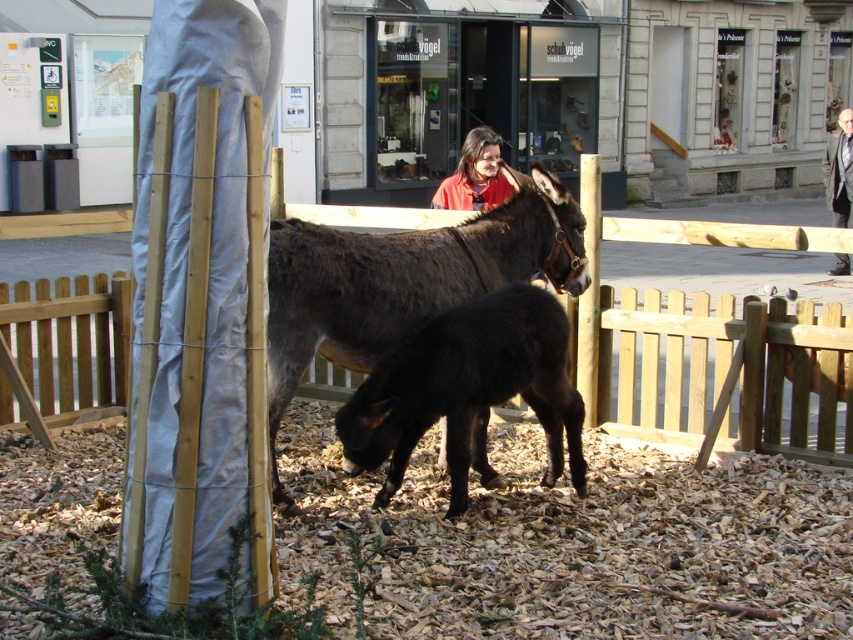
Question: Can you confirm if wooden fence at center is positioned above dark brown glossy donkey at center?

Choices:
 (A) yes
 (B) no

Answer: (B)

Question: Which point appears closest to the camera in this image?

Choices:
 (A) (612, 406)
 (B) (471, 296)
 (C) (495, 179)

Answer: (B)

Question: Is wooden fence at center above dark brown glossy donkey at center?

Choices:
 (A) no
 (B) yes

Answer: (A)

Question: Can you confirm if wooden fence at center is smaller than red matte shirt at center?

Choices:
 (A) yes
 (B) no

Answer: (A)

Question: Which point is closer to the camera?

Choices:
 (A) (735, 432)
 (B) (422, 305)
 (C) (466, 140)

Answer: (B)

Question: Which of the following is the closest to the observer?

Choices:
 (A) dark brown glossy donkey at center
 (B) red matte shirt at center

Answer: (A)